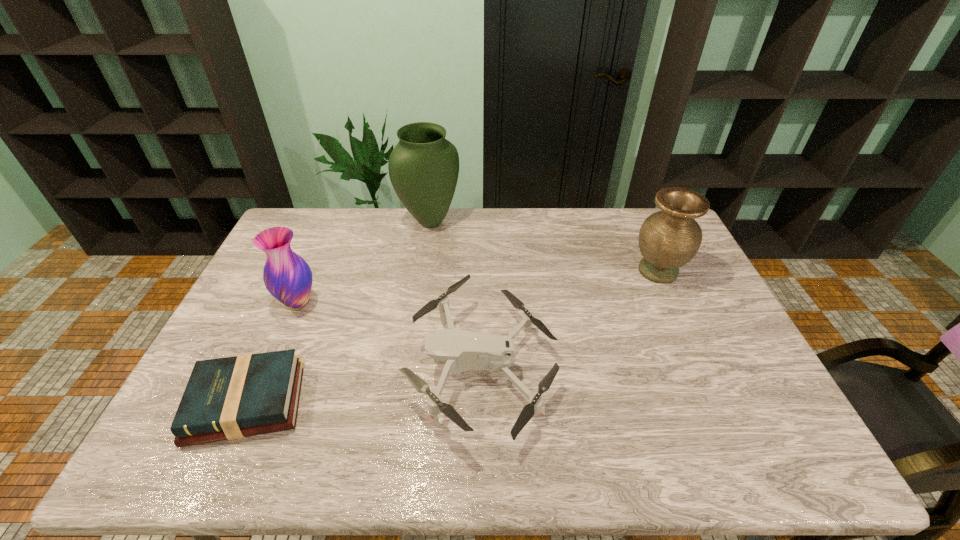
What are the coordinates of `the farthest object` in the screenshot? It's located at (423, 167).

Find the location of a particular element. Image resolution: width=960 pixels, height=540 pixels. the farthest vase is located at coordinates (423, 167).

Locate an element on the screen. The height and width of the screenshot is (540, 960). the rightmost object is located at coordinates (668, 239).

Identify the location of the leftmost vase. (287, 276).

This screenshot has width=960, height=540. Find the location of `drone`. drone is located at coordinates coord(460,351).

I want to click on hardback book, so click(x=229, y=398).

Where is `vacant area situated on the front of the second vase from right to left`? Image resolution: width=960 pixels, height=540 pixels. vacant area situated on the front of the second vase from right to left is located at coordinates coord(422,267).

Find the location of a particular element. Image resolution: width=960 pixels, height=540 pixels. vacant space positioned 0.270m on the back of the rightmost vase is located at coordinates (631, 211).

Where is `vacant space situated on the back of the leftmost vase`? vacant space situated on the back of the leftmost vase is located at coordinates (335, 217).

Locate an element on the screen. This screenshot has width=960, height=540. free point located with a camera at the front of the fourth tallest object is located at coordinates (348, 367).